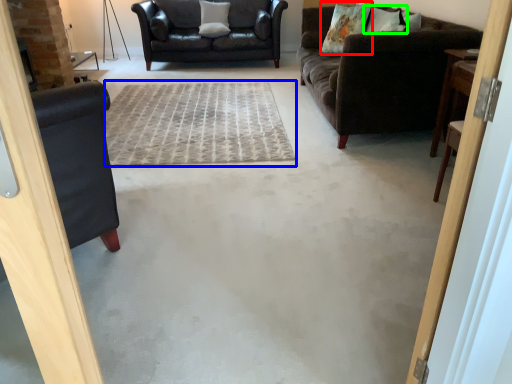
Question: Which object is positioned closest to pillow (highlighted by a red box)? Select from plain (highlighted by a blue box) and pillow (highlighted by a green box).

Choices:
 (A) plain
 (B) pillow

Answer: (B)